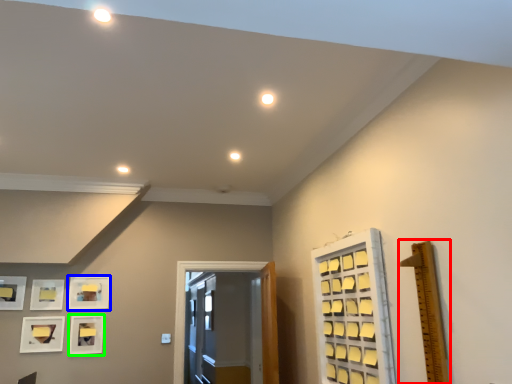
Question: Estimate the real-world distances between objects in this image. Which object is farther from ruler (highlighted by a red box), picture frame (highlighted by a blue box) or picture frame (highlighted by a green box)?

Choices:
 (A) picture frame
 (B) picture frame

Answer: (B)